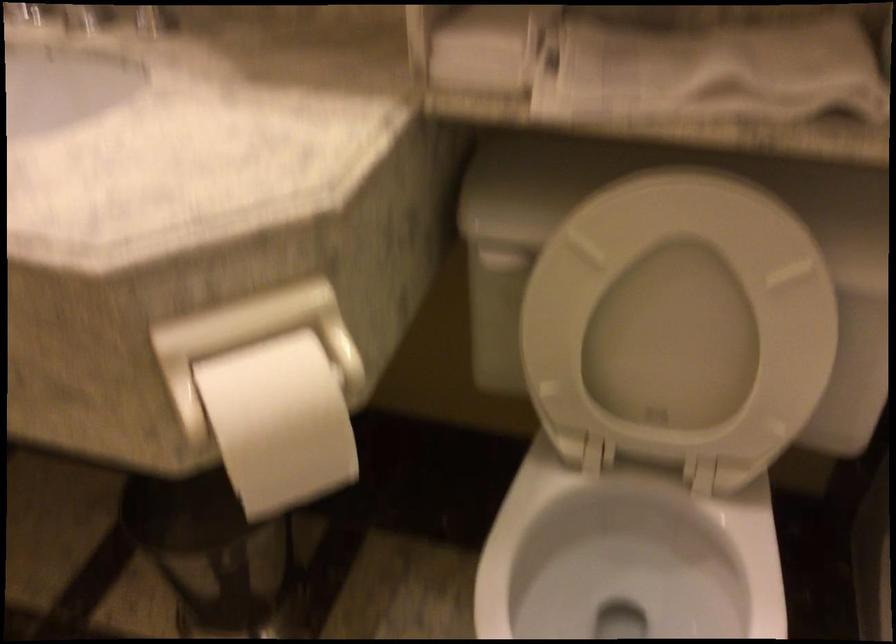
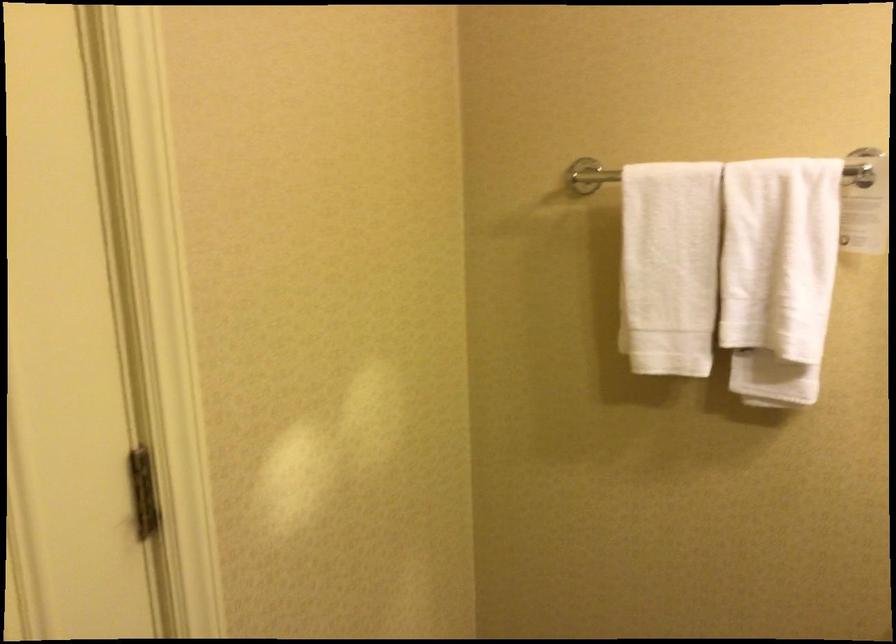
Consider the image. The first image is from the beginning of the video and the second image is from the end. How did the camera likely rotate when shooting the video?

The camera's rotation is toward left-down.